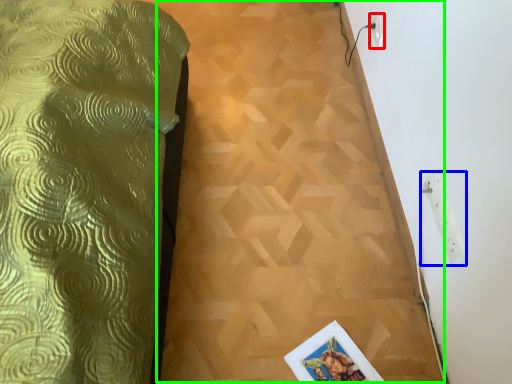
Question: Considering the real-world distances, which object is farthest from electric outlet (highlighted by a red box)? electric outlet (highlighted by a blue box) or plywood (highlighted by a green box)?

Choices:
 (A) electric outlet
 (B) plywood

Answer: (A)